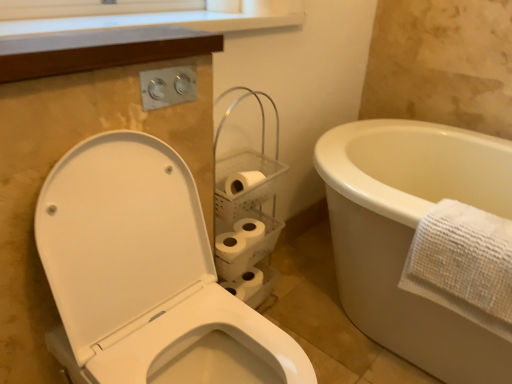
Question: Could you tell me if white textured towel at right is facing white matte toilet paper at center?

Choices:
 (A) yes
 (B) no

Answer: (B)

Question: Can you confirm if white textured towel at right is taller than white matte toilet paper at center?

Choices:
 (A) no
 (B) yes

Answer: (B)

Question: From a real-world perspective, is white textured towel at right beneath white matte toilet paper at center?

Choices:
 (A) no
 (B) yes

Answer: (A)

Question: Considering the relative sizes of white textured towel at right and white matte toilet paper at center in the image provided, is white textured towel at right thinner than white matte toilet paper at center?

Choices:
 (A) yes
 (B) no

Answer: (B)

Question: From a real-world perspective, does white textured towel at right stand above white matte toilet paper at center?

Choices:
 (A) yes
 (B) no

Answer: (A)

Question: Relative to white textured towel at right, is white matte toilet paper at center in front or behind?

Choices:
 (A) behind
 (B) front

Answer: (A)

Question: Is white matte toilet paper at center situated inside white textured towel at right or outside?

Choices:
 (A) inside
 (B) outside

Answer: (B)

Question: In terms of size, does white matte toilet paper at center appear bigger or smaller than white textured towel at right?

Choices:
 (A) small
 (B) big

Answer: (A)

Question: Would you say white matte toilet paper at center is to the left or to the right of white textured towel at right in the picture?

Choices:
 (A) left
 (B) right

Answer: (A)

Question: Considering their positions, is white glossy toilet at left located in front of or behind white matte toilet paper at center?

Choices:
 (A) front
 (B) behind

Answer: (A)

Question: In terms of height, does white glossy toilet at left look taller or shorter compared to white matte toilet paper at center?

Choices:
 (A) tall
 (B) short

Answer: (A)

Question: Looking at their shapes, would you say white glossy toilet at left is wider or thinner than white matte toilet paper at center?

Choices:
 (A) thin
 (B) wide

Answer: (B)

Question: Is white glossy toilet at left bigger or smaller than white matte toilet paper at center?

Choices:
 (A) small
 (B) big

Answer: (B)

Question: From their relative heights in the image, would you say white glossy toilet at left is taller or shorter than white textured towel at right?

Choices:
 (A) tall
 (B) short

Answer: (A)

Question: From the image's perspective, is white glossy toilet at left located above or below white textured towel at right?

Choices:
 (A) above
 (B) below

Answer: (B)